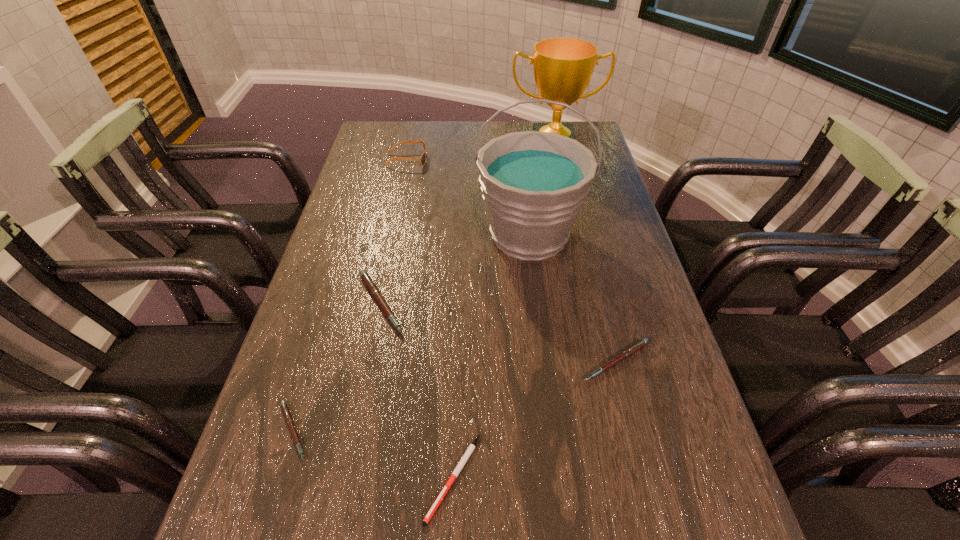
The image size is (960, 540). Identify the location of bucket situated at the right edge. (534, 184).

At what (x,y) coordinates should I click in order to perform the action: click on award that is at the right edge. Please return your answer as a coordinate pair (x, y). The image size is (960, 540). Looking at the image, I should click on (563, 67).

You are a GUI agent. You are given a task and a screenshot of the screen. Output one action in this format:
    pyautogui.click(x=<x>, y=<y>)
    Task: Click on the pen located in the right edge section of the desktop
    The height and width of the screenshot is (540, 960).
    Given the screenshot: What is the action you would take?
    pyautogui.click(x=637, y=346)

Locate an element on the screen. object located at the far left corner is located at coordinates (422, 159).

Find the location of a particular element. object that is at the far right corner is located at coordinates (x=563, y=67).

In the image, there is a desktop. At what (x,y) coordinates should I click in order to perform the action: click on vacant space at the far edge. Please return your answer as a coordinate pair (x, y). Image resolution: width=960 pixels, height=540 pixels. Looking at the image, I should click on (420, 145).

In the image, there is a desktop. Where is `vacant space at the left edge`? This screenshot has height=540, width=960. vacant space at the left edge is located at coordinates coord(326,407).

The image size is (960, 540). I want to click on free region at the right edge, so click(x=695, y=426).

Identify the location of free space at the far left corner of the desktop. The image size is (960, 540). (365, 149).

In the image, there is a desktop. Where is `vacant space at the far right corner`? The image size is (960, 540). vacant space at the far right corner is located at coordinates (582, 121).